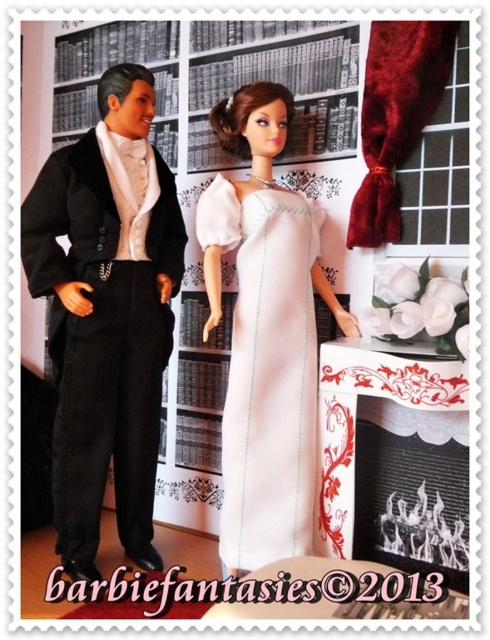
You are a tailor inspecting two black suits on dolls in a library setting. You need to determine which one is larger. The suits are the satin black suit at left and the velvet black tuxedo at left. Which one is bigger?

The satin black suit at left is bigger than the velvet black tuxedo at left.

You are a tailor measuring the width of two black outfits for a client. The outfits are the satin black suit at left and the velvet black tuxedo at left. Which one has a wider measurement?

The satin black suit at left is wider than the velvet black tuxedo at left according to the description provided.